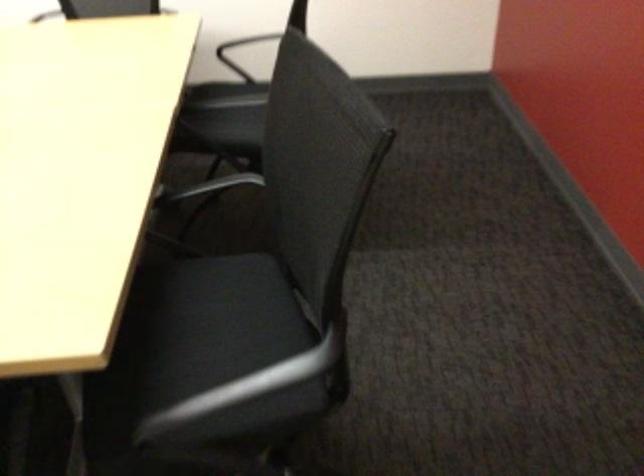
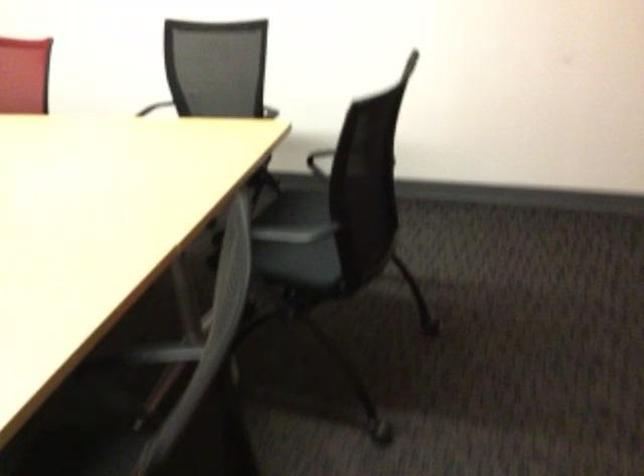
Question: The images are taken continuously from a first-person perspective. In which direction is your viewpoint rotating?

Choices:
 (A) Left
 (B) Right
 (C) Up
 (D) Down

Answer: (A)